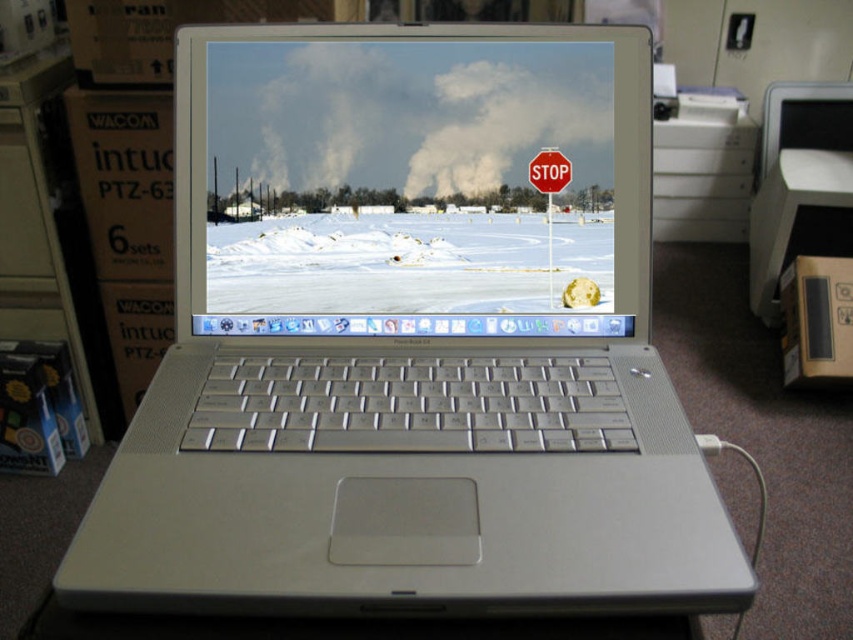
You are designing a new laptop screen with a stop sign overlay. The matte plastic screen at center and metallic red stop sign at center must be placed on the screen. Given that the laptop screen is 13 inches wide, can both elements fit side by side without overlapping?

The distance between the matte plastic screen at center and metallic red stop sign at center is 5.42 inches. Since the laptop screen is 13 inches wide, both elements can fit side by side without overlapping as 5.42 inches is less than 13 inches.

You are an office worker who needs to check the position of the matte plastic screen at center and the metallic red stop sign at center on your laptop screen. From your perspective, which object is located to the left?

The matte plastic screen at center is positioned on the left side of metallic red stop sign at center, so the matte plastic screen at center is located to the left.

You are an office worker who needs to print a document. You see the matte plastic screen at center and the metallic red stop sign at center on your laptop screen. Which object takes up more horizontal space on the screen?

The matte plastic screen at center has a greater width than the metallic red stop sign at center, so the matte plastic screen at center takes up more horizontal space on the screen.